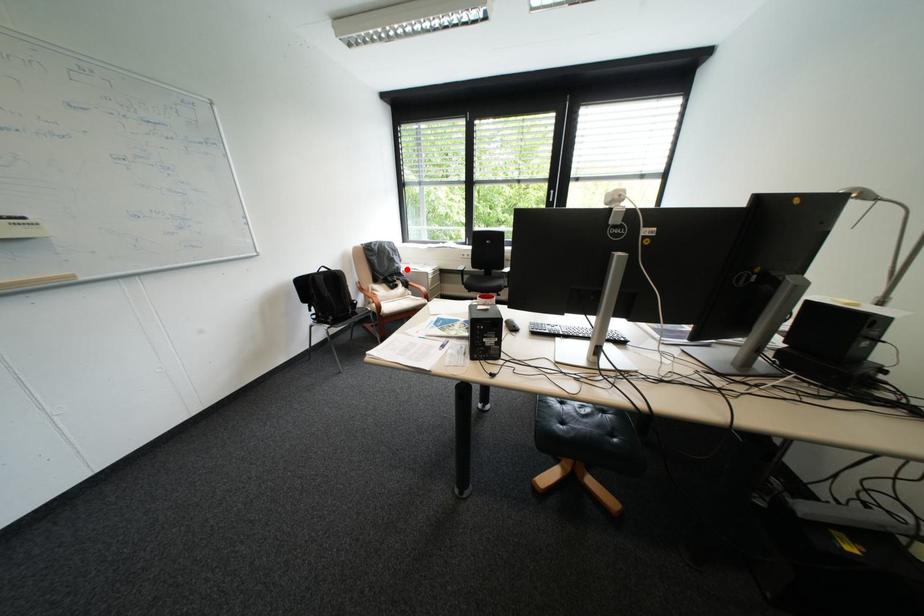
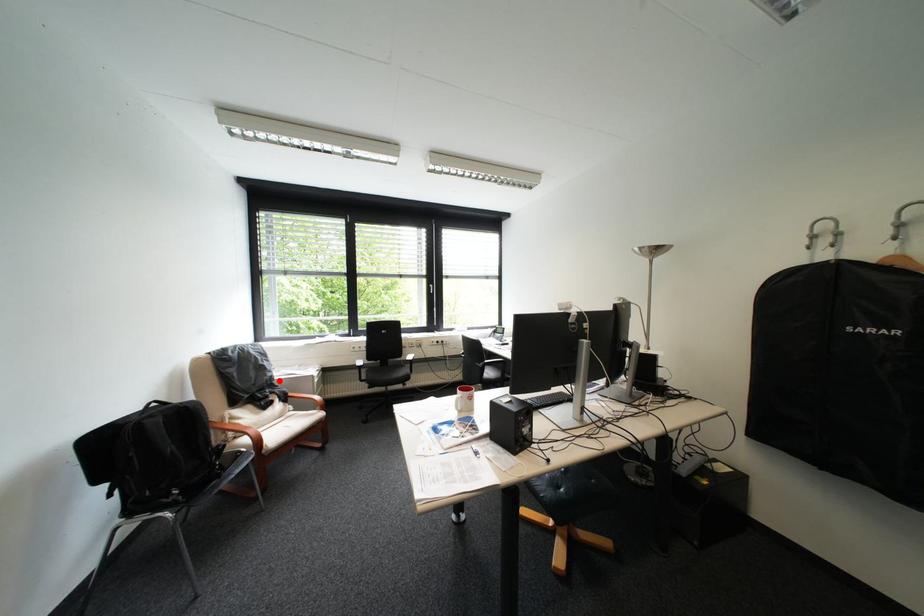
I am providing you with two images of the same scene from different viewpoints. A red point is marked on the first image and another point is marked on the second image. Are the points marked in image1 and image2 representing the same 3D position?

Yes